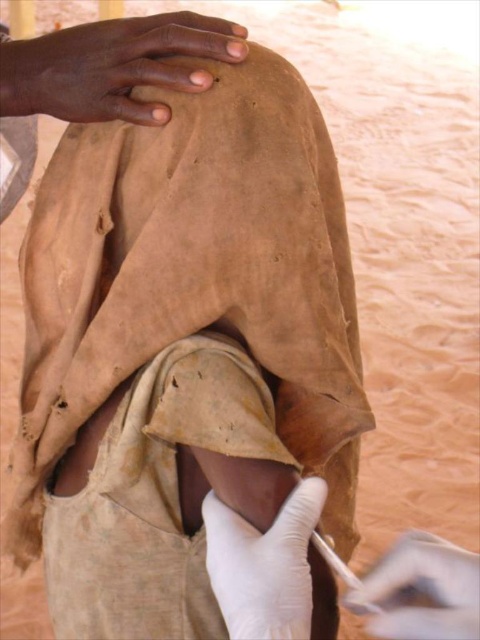
Question: Which object is the farthest from the white rubber glove at lower center?

Choices:
 (A) smooth skin hand at upper center
 (B) white latex glove at lower center

Answer: (A)

Question: Is smooth skin hand at upper center above white latex glove at lower center?

Choices:
 (A) yes
 (B) no

Answer: (A)

Question: Which point is closer to the camera taking this photo?

Choices:
 (A) (101, 99)
 (B) (279, 637)
 (C) (425, 536)

Answer: (B)

Question: Is smooth skin hand at upper center positioned in front of white rubber glove at lower center?

Choices:
 (A) yes
 (B) no

Answer: (B)

Question: Can you confirm if smooth skin hand at upper center is thinner than white rubber glove at lower center?

Choices:
 (A) yes
 (B) no

Answer: (B)

Question: Estimate the real-world distances between objects in this image. Which object is closer to the white rubber glove at lower center?

Choices:
 (A) white latex glove at lower center
 (B) smooth skin hand at upper center

Answer: (A)